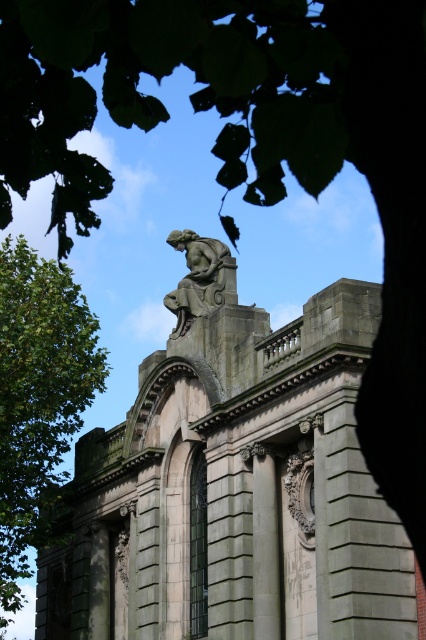
Looking at this image, you are standing in front of the classical building and notice a specific point marked at coordinates (233, 483). Based on the scene description, can you identify which object this point is located on?

The point at coordinates (233, 483) is located on the gray stone statue at upper center.

You are standing in front of the classical building and want to locate the gray stone statue at upper center. According to the coordinates, where exactly is it positioned?

The gray stone statue at upper center is located at point (233, 483).

You are standing in front of the classical building and want to take a photo of the gray stone statue at upper center and the green leafy tree at left. Based on their positions, which object should you place on the right side of your photo frame?

The gray stone statue at upper center should be placed on the right side of your photo frame because it is positioned to the right of the green leafy tree at left in the scene.